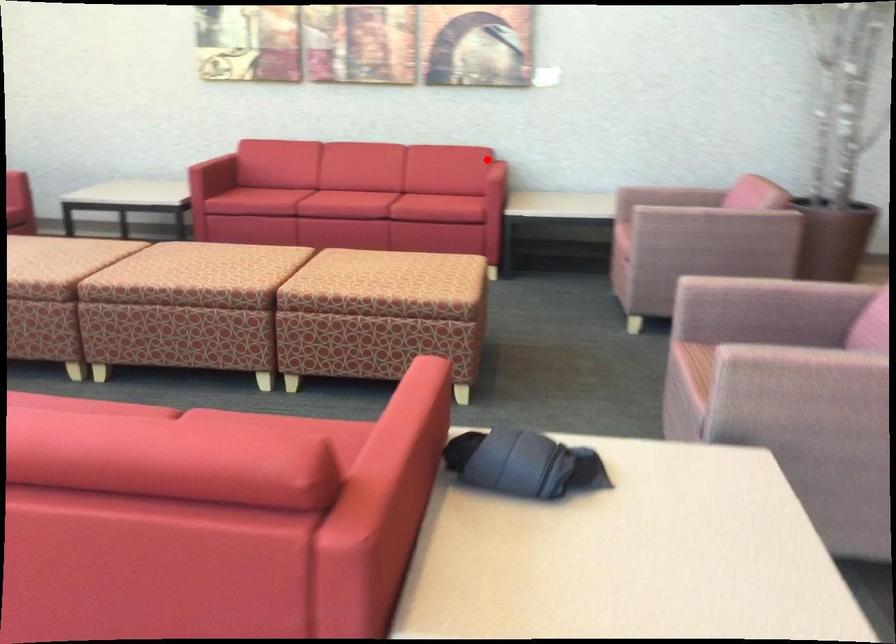
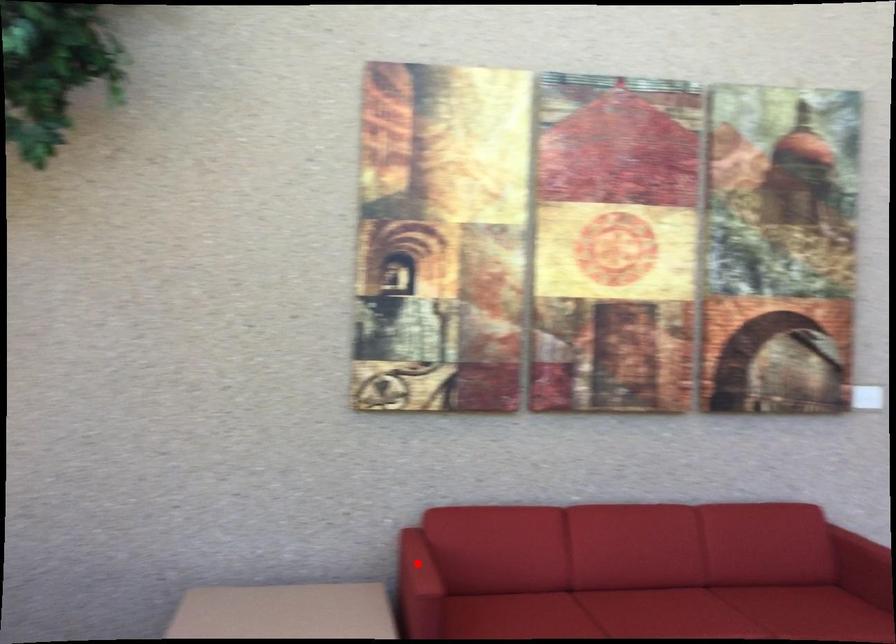
I am providing you with two images of the same scene from different viewpoints. A red point is marked on the first image and another point is marked on the second image. Are the points marked in image1 and image2 representing the same 3D position?

No